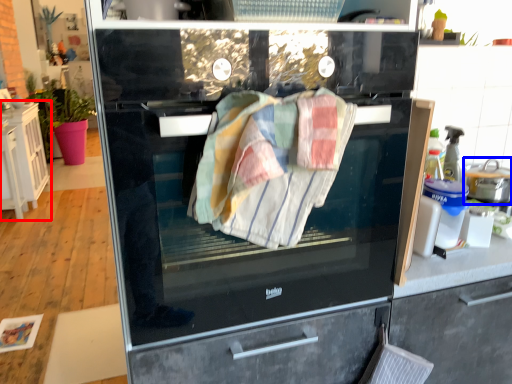
Question: Which object is further to the camera taking this photo, cabinetry (highlighted by a red box) or kitchen appliance (highlighted by a blue box)?

Choices:
 (A) cabinetry
 (B) kitchen appliance

Answer: (A)